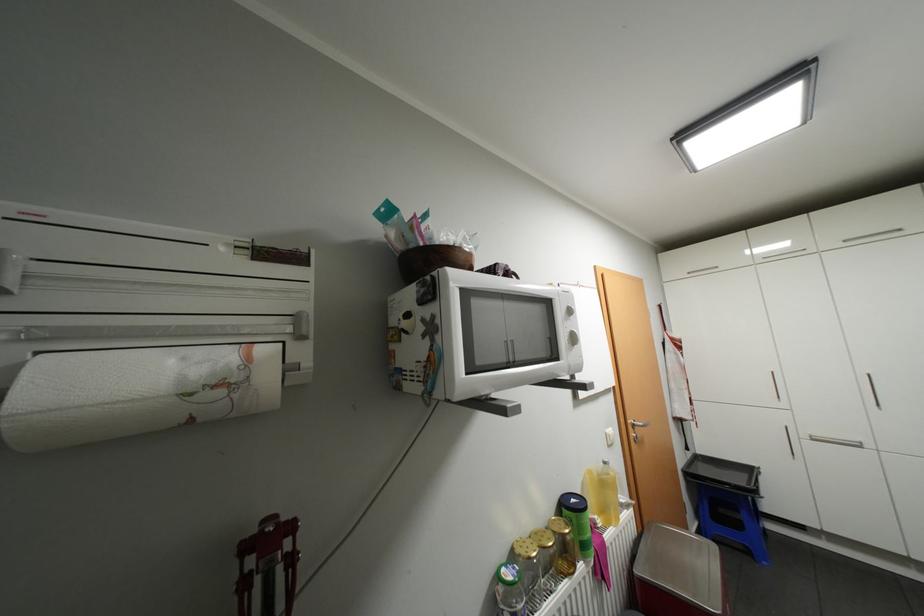
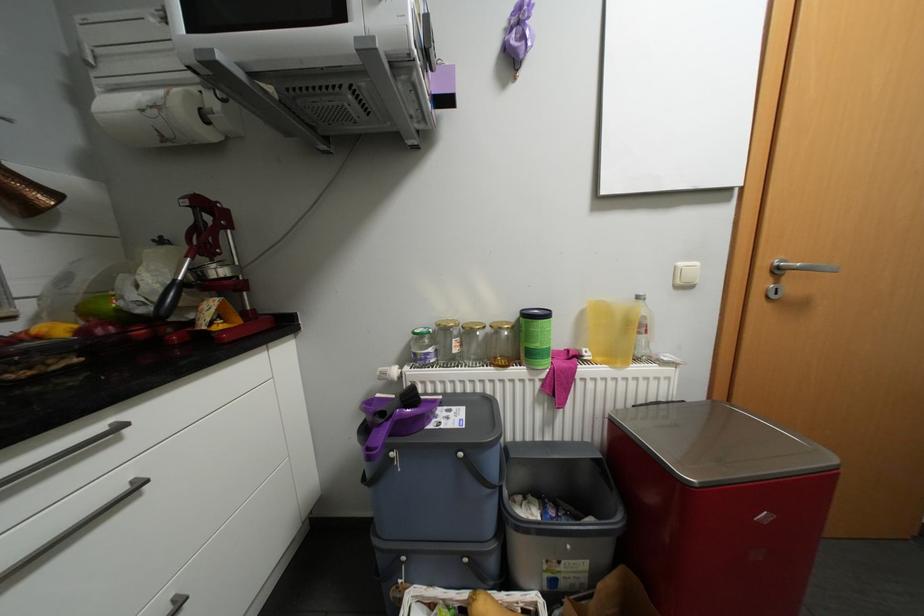
The images are taken continuously from a first-person perspective. In which direction is your viewpoint rotating?

The camera rotated toward left-down.